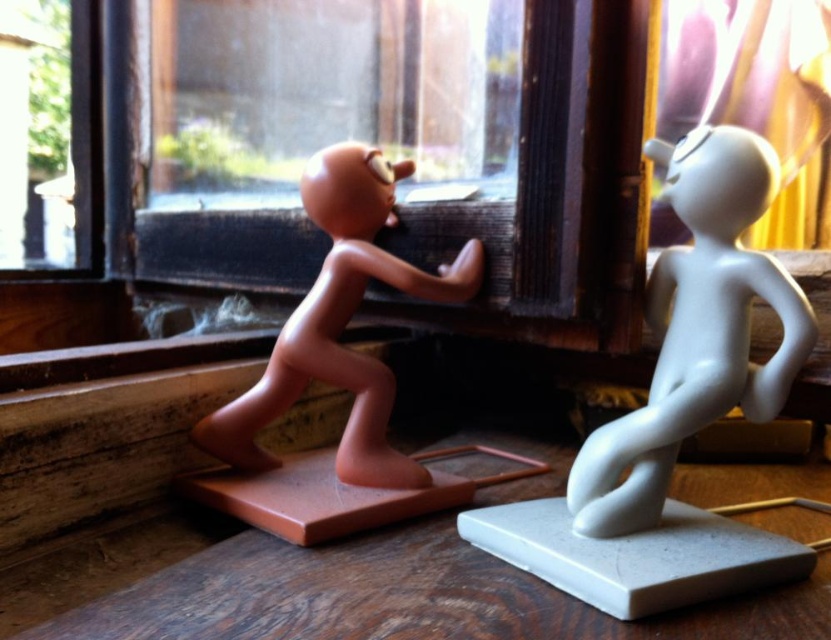
Question: Is white matte figure at right wider than matte brown figure at left?

Choices:
 (A) yes
 (B) no

Answer: (B)

Question: Which of the following is the closest to the observer?

Choices:
 (A) white matte figure at right
 (B) matte brown figure at left

Answer: (A)

Question: Can you confirm if white matte figure at right is thinner than matte brown figure at left?

Choices:
 (A) no
 (B) yes

Answer: (B)

Question: Which point appears farthest from the camera in this image?

Choices:
 (A) (602, 536)
 (B) (366, 225)

Answer: (B)

Question: Is white matte figure at right below matte brown figure at left?

Choices:
 (A) yes
 (B) no

Answer: (A)